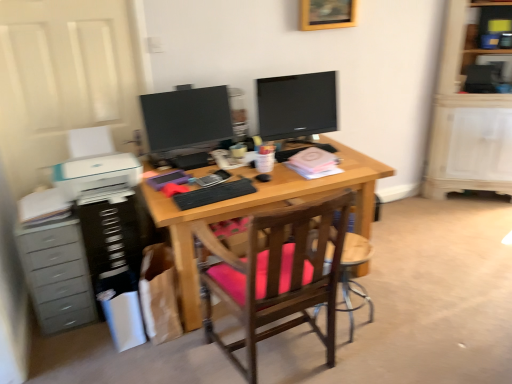
Question: Based on their sizes in the image, would you say black plastic dresser at left is bigger or smaller than gray plastic chest of drawers at left?

Choices:
 (A) big
 (B) small

Answer: (B)

Question: From the image's perspective, relative to gray plastic chest of drawers at left, is black plastic dresser at left above or below?

Choices:
 (A) above
 (B) below

Answer: (A)

Question: Which of these objects is positioned closest to the wooden shelf at upper right?

Choices:
 (A) wooden chair at center
 (B) wooden picture frame at upper center
 (C) matte black monitor at center, marked as the 1th television in a right-to-left arrangement
 (D) matte black monitor at center, which ranks as the 2th television in right-to-left order
 (E) black matte keyboard at center

Answer: (B)

Question: Based on their relative distances, which object is farther from the matte black monitor at center, the 2th television when ordered from left to right?

Choices:
 (A) black matte keyboard at center
 (B) wooden chair at center
 (C) gray plastic chest of drawers at left
 (D) wooden shelf at upper right
 (E) wooden chair with pink cushion at center

Answer: (D)